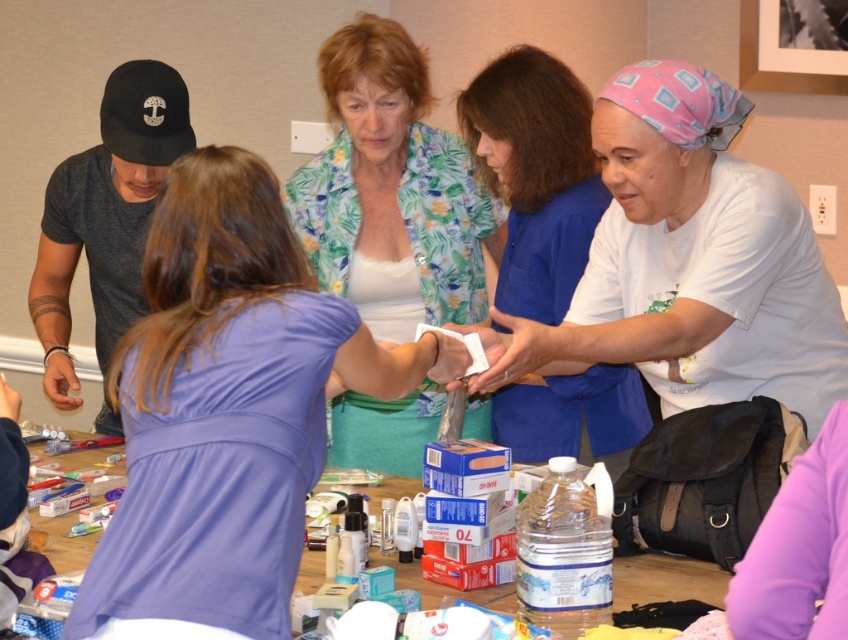
Looking at the scene described, which object is positioned to the right of the other between the matte white paper at center and the white matte bandage at center?

The matte white paper at center is positioned to the right of the white matte bandage at center.

You are taking a photo of the scene and want to focus on both point (81, 621) and point (59, 374). Which point is closer to your camera so you can adjust your focus accordingly?

Point (81, 621) is closer to the camera than point (59, 374), so you should focus on that point first.

You are a photographer standing at the entrance of the room. You want to take a photo that includes both the purple fabric shirt at center and the pink fabric headscarf at upper right. What is the minimum distance you need to move backward to ensure both subjects are in frame?

The purple fabric shirt at center is 28.68 inches away from the pink fabric headscarf at upper right. To include both in the frame, you need to move backward until the distance between them fits within your camera lens view. However, without knowing the camera lens specifications, it is impossible to determine the exact distance required.